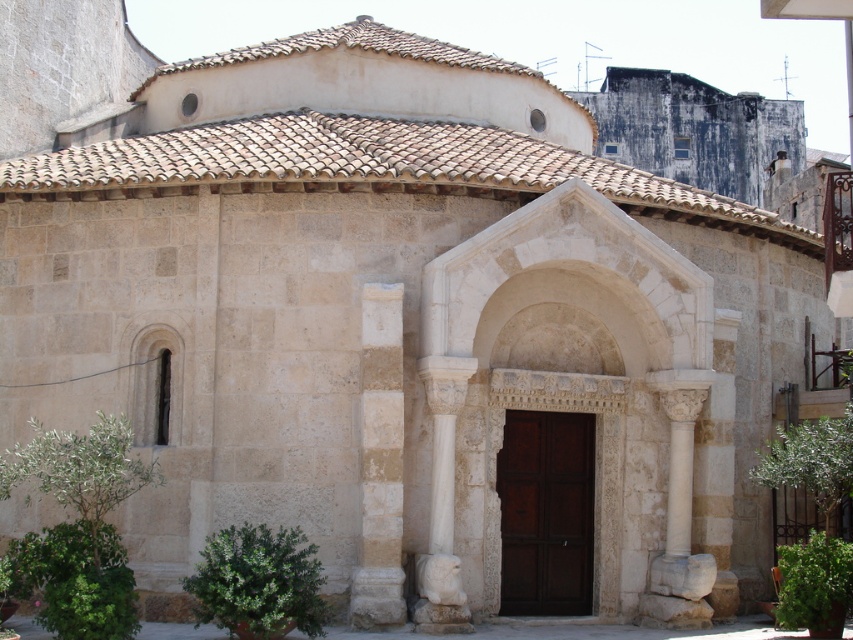
You are an architect examining the historic stone building. You notice the white stone archway at center and the white stone column at center. Which of these two elements is bigger in size?

The white stone archway at center is larger in size than the white stone column at center.

You are standing 30 meters away from a historic stone building. You want to take a photo of the entrance, which is marked by a point at coordinates point (473, 244). Will you be able to capture the entrance in your photo from your current position?

The distance of point (473, 244) from viewer is 31.27 meters. Since you are currently 30 meters away, you are 1.27 meters too close to capture the entrance at point (473, 244). You need to move back 1.27 meters to be at the correct distance.

You are an architect examining the historic stone building. You notice the white stone archway at center and the white stone column at center. Which one do you think has a greater width?

The white stone archway at center might be wider than white stone column at center according to the description.